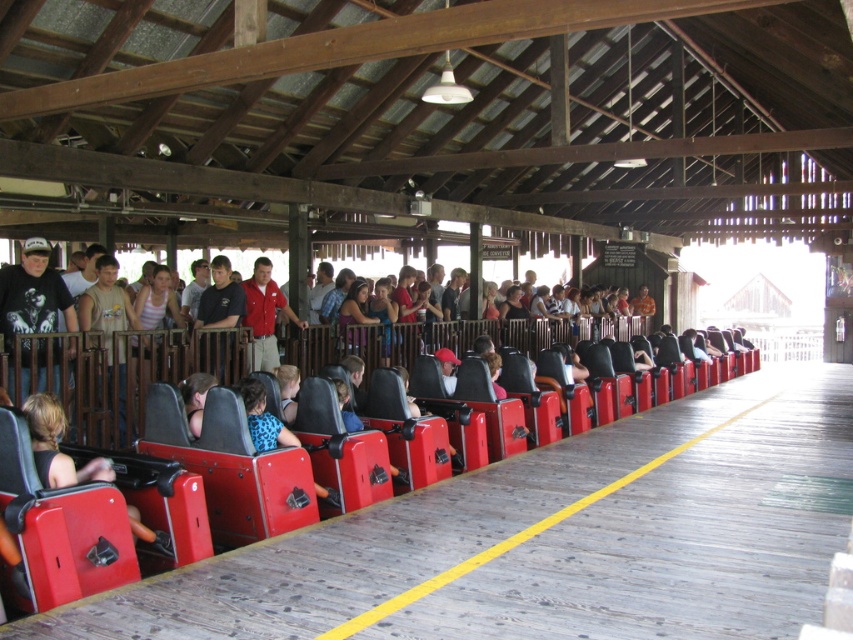
Is point (32, 260) closer to viewer compared to point (260, 324)?

That is True.

Who is positioned more to the left, matte black t-shirt at left or red cotton shirt at center?

Positioned to the left is matte black t-shirt at left.

Who is more forward, (42, 276) or (263, 305)?

Point (42, 276) is in front.

Identify the location of matte black t-shirt at left. The height and width of the screenshot is (640, 853). (32, 296).

Is point (39, 292) farther from viewer compared to point (54, 428)?

Yes, point (39, 292) is behind point (54, 428).

Consider the image. Who is more distant from viewer, (65,321) or (79,477)?

The point (65,321) is more distant.

Locate an element on the screen. This screenshot has width=853, height=640. matte black t-shirt at left is located at coordinates (32, 296).

Can you confirm if matte black seat at center is positioned to the left of red cotton shirt at center?

Indeed, matte black seat at center is positioned on the left side of red cotton shirt at center.

Who is more forward, [67,460] or [250,298]?

Positioned in front is point [67,460].

Is point (56, 426) farther from viewer compared to point (263, 365)?

No.

Find the location of a particular element. This screenshot has height=640, width=853. matte black seat at center is located at coordinates (57, 445).